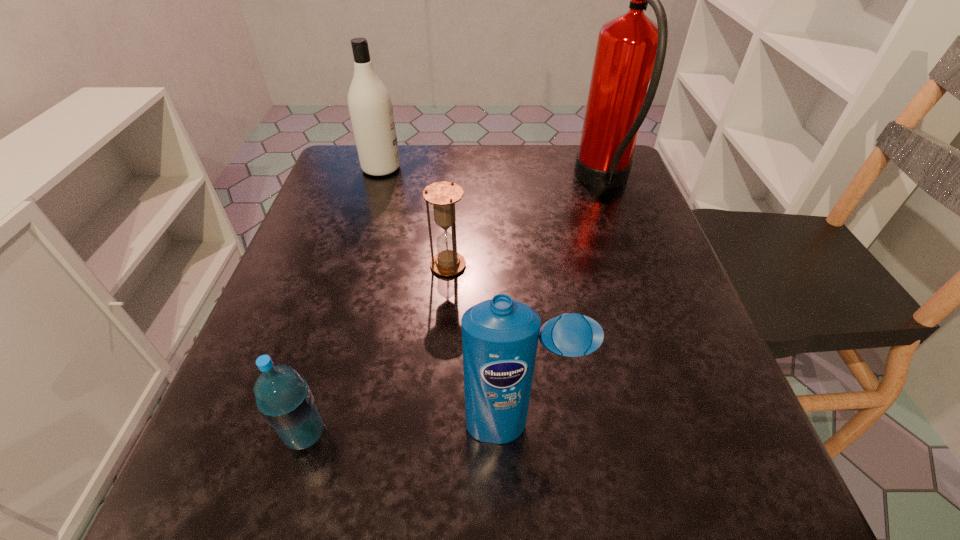
This screenshot has height=540, width=960. I want to click on vacant area situated 0.320m on the back of the fourth object from left to right, so [508, 259].

This screenshot has width=960, height=540. Identify the location of free region located 0.250m on the back of the water bottle. (348, 288).

Find the location of a particular element. The height and width of the screenshot is (540, 960). free space located on the front of the hourglass is located at coordinates (436, 435).

Locate an element on the screen. fire extinguisher that is positioned at the far edge is located at coordinates (630, 52).

Where is `shampoo present at the far edge`? This screenshot has height=540, width=960. shampoo present at the far edge is located at coordinates (370, 106).

The image size is (960, 540). I want to click on shampoo situated at the left edge, so click(x=370, y=106).

This screenshot has width=960, height=540. I want to click on water bottle situated at the left edge, so click(x=283, y=397).

Identify the location of object that is at the right edge. Image resolution: width=960 pixels, height=540 pixels. (630, 52).

The height and width of the screenshot is (540, 960). I want to click on object located at the far left corner, so click(x=370, y=106).

Image resolution: width=960 pixels, height=540 pixels. In order to click on object that is at the far right corner in this screenshot , I will do `click(630, 52)`.